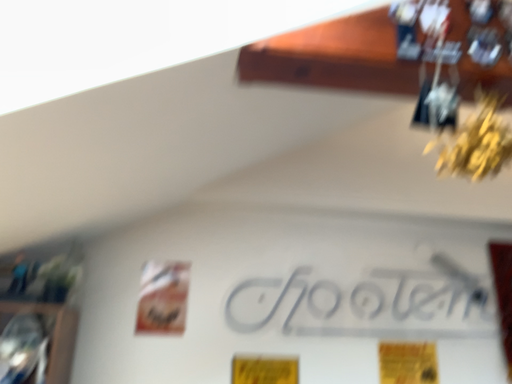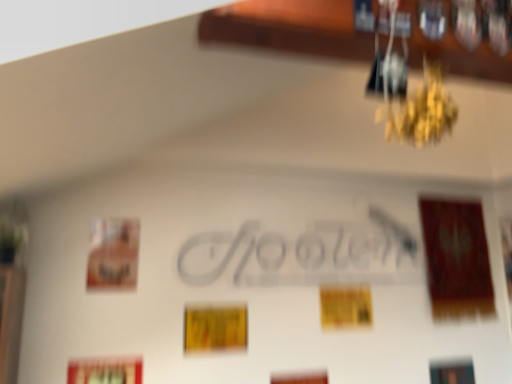
Question: How did the camera likely rotate when shooting the video?

Choices:
 (A) rotated left
 (B) rotated right

Answer: (B)